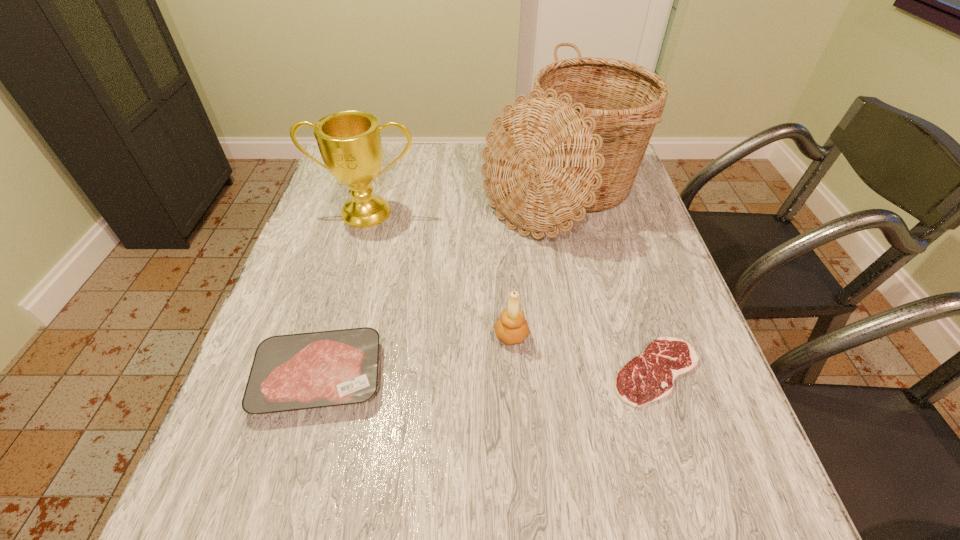
Identify the location of vacant space at the left edge of the desktop. (305, 248).

In the image, there is a desktop. Where is `vacant space at the right edge`? vacant space at the right edge is located at coordinates click(x=642, y=278).

Locate an element on the screen. The image size is (960, 540). vacant space at the near right corner is located at coordinates [669, 483].

You are a GUI agent. You are given a task and a screenshot of the screen. Output one action in this format:
    pyautogui.click(x=<x>, y=<y>)
    Task: Click on the free space that is in between the basket and the shorter steak
    
    Given the screenshot: What is the action you would take?
    pyautogui.click(x=608, y=282)

Locate an element on the screen. The image size is (960, 540). empty space between the second shortest object and the award is located at coordinates tap(344, 294).

Locate an element on the screen. vacant area between the shorter steak and the candle_holder is located at coordinates (584, 354).

Where is `empty location between the left steak and the tallest object`? empty location between the left steak and the tallest object is located at coordinates (439, 284).

Locate an element on the screen. free space that is in between the second tallest object and the second shortest object is located at coordinates 344,294.

Where is `vacant space that's between the basket and the taller steak`? This screenshot has height=540, width=960. vacant space that's between the basket and the taller steak is located at coordinates (439, 284).

This screenshot has width=960, height=540. I want to click on blank region between the left steak and the shortest object, so click(x=488, y=374).